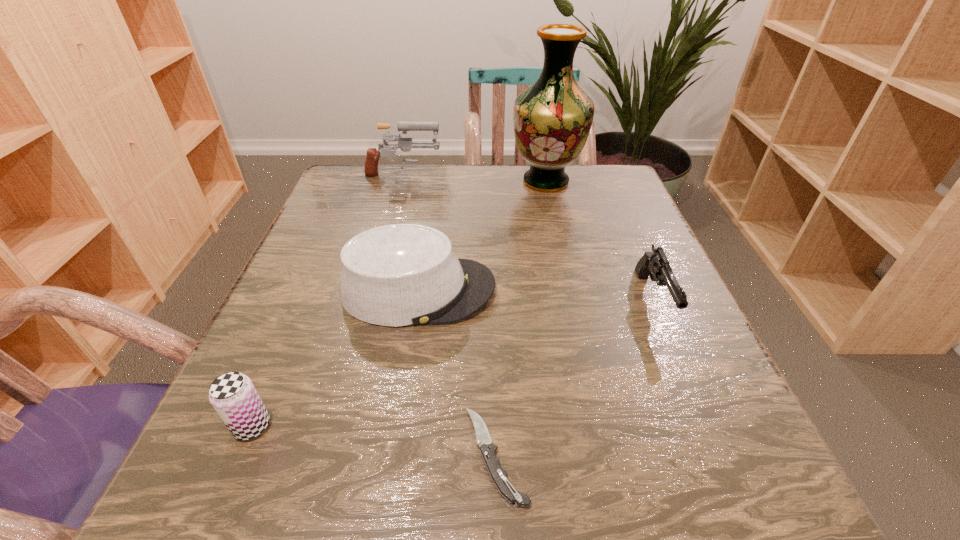
Where is `blank space at the far right corner of the desktop`? blank space at the far right corner of the desktop is located at coordinates [x=615, y=169].

In the image, there is a desktop. Where is `vacant region at the near right corner`? vacant region at the near right corner is located at coordinates (720, 482).

Locate an element on the screen. The height and width of the screenshot is (540, 960). vacant space in between the beer can and the pocketknife is located at coordinates (373, 441).

Where is `unoccupied position between the pocketknife and the rightmost object`? unoccupied position between the pocketknife and the rightmost object is located at coordinates pyautogui.click(x=574, y=378).

Image resolution: width=960 pixels, height=540 pixels. In order to click on vacant area that lies between the beer can and the nearer gun in this screenshot , I will do `click(452, 363)`.

Locate an element on the screen. The width and height of the screenshot is (960, 540). blank region between the pocketknife and the hat is located at coordinates (457, 373).

You are a GUI agent. You are given a task and a screenshot of the screen. Output one action in this format:
    pyautogui.click(x=<x>, y=<y>)
    Task: Click on the empty space between the beer can and the nearer gun
    This screenshot has width=960, height=540.
    Given the screenshot: What is the action you would take?
    pyautogui.click(x=452, y=363)

What are the coordinates of `free spot between the hat and the tallest object` in the screenshot? It's located at (482, 235).

Locate an element on the screen. free space between the beer can and the hat is located at coordinates (335, 358).

Locate an element on the screen. The image size is (960, 540). vacant area that lies between the vase and the farther gun is located at coordinates (474, 180).